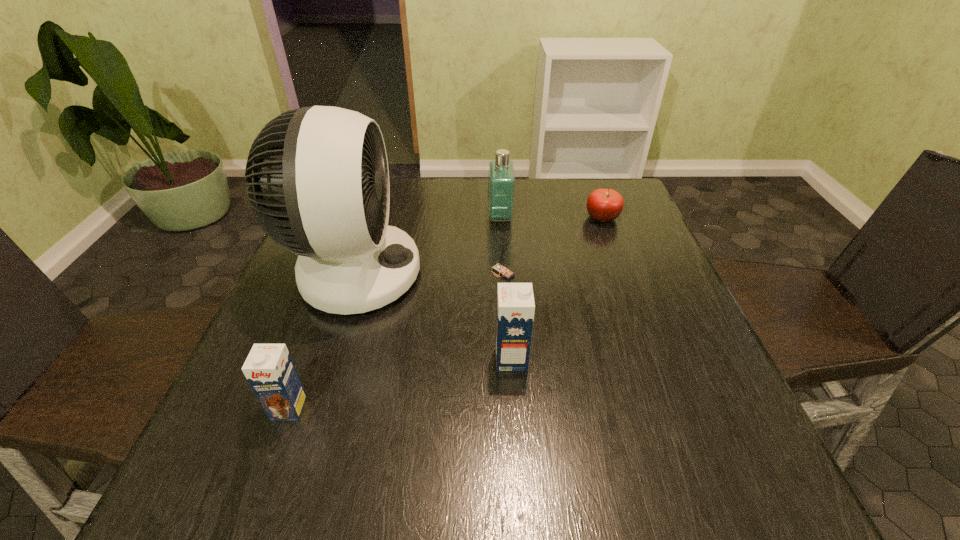
I want to click on vacant position located 0.140m on the front label of the perfume, so click(437, 217).

I want to click on free space located 0.070m on the front label of the perfume, so click(x=463, y=217).

I want to click on vacant point located on the front label of the perfume, so click(x=408, y=217).

In order to click on free location located 0.160m on the grille of the fan in this screenshot , I will do `click(489, 274)`.

Where is `vacant position located on the back of the matchbox`? This screenshot has width=960, height=540. vacant position located on the back of the matchbox is located at coordinates (501, 241).

The image size is (960, 540). What are the coordinates of `apple that is at the far edge` in the screenshot? It's located at (604, 205).

You are a GUI agent. You are given a task and a screenshot of the screen. Output one action in this format:
    pyautogui.click(x=<x>, y=<y>)
    Task: Click on the perfume at the far edge
    
    Given the screenshot: What is the action you would take?
    pyautogui.click(x=501, y=177)

This screenshot has width=960, height=540. Find the location of `object at the near edge`. object at the near edge is located at coordinates (269, 369).

Identify the location of chocolate milk present at the left edge. (269, 369).

The width and height of the screenshot is (960, 540). What are the coordinates of `fan that is at the left edge` in the screenshot? It's located at (318, 184).